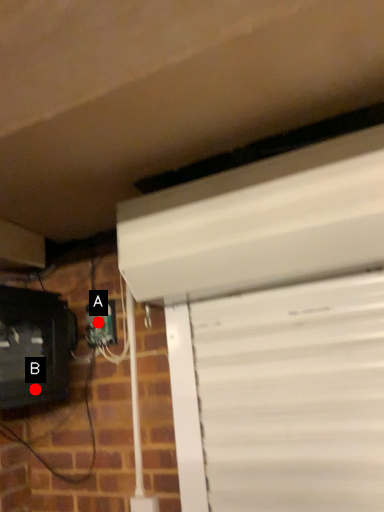
Question: Two points are circled on the image, labeled by A and B beside each circle. Which point is farther from the camera taking this photo?

Choices:
 (A) A is further
 (B) B is further

Answer: (A)